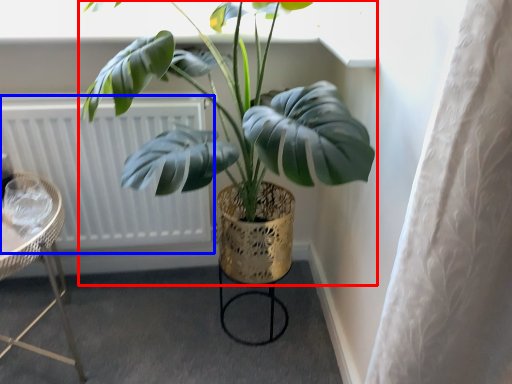
Question: Which point is further to the camera, houseplant (highlighted by a red box) or radiator (highlighted by a blue box)?

Choices:
 (A) houseplant
 (B) radiator

Answer: (B)